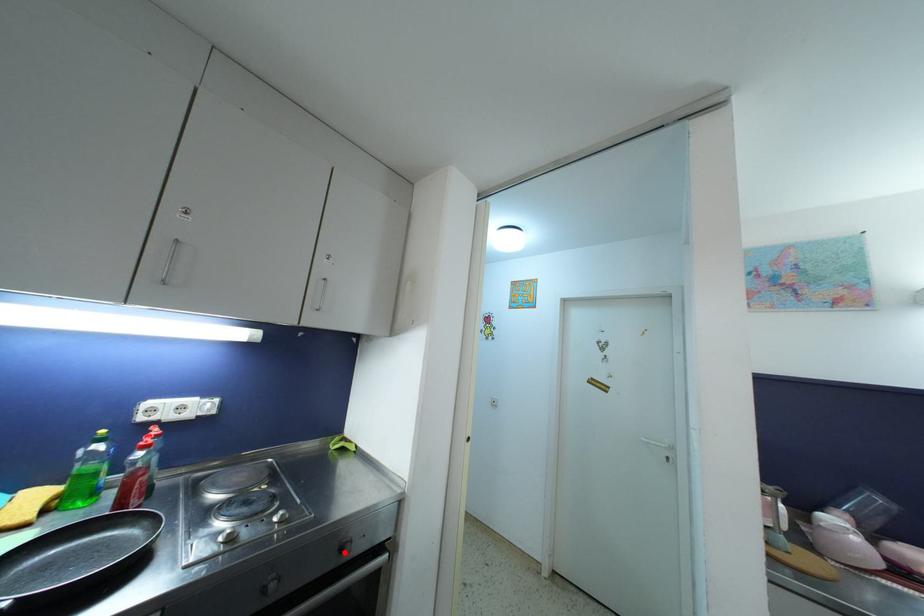
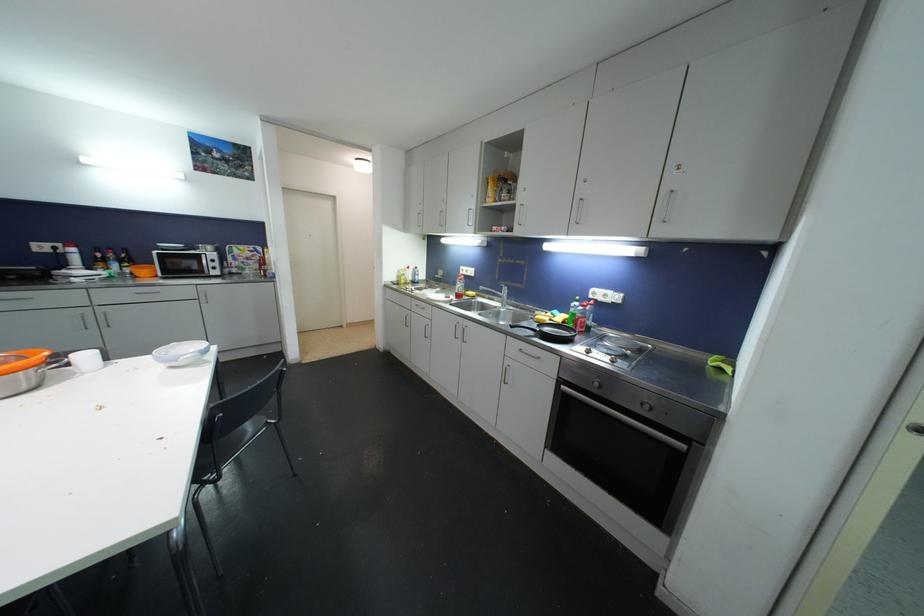
Locate, in the second image, the point that corresponds to the highlighted location in the first image.

(646, 407)